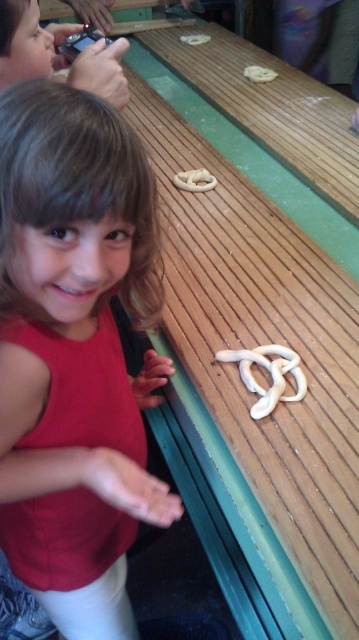
Looking at this image, who is taller, wooden picnic table at center or matte red shirt at center?

wooden picnic table at center is taller.

Does wooden picnic table at center appear over matte red shirt at center?

Yes.

Does point (308, 586) come closer to viewer compared to point (151, 269)?

Yes, it is.

Find the location of `wooden picnic table at center`. wooden picnic table at center is located at coordinates (258, 344).